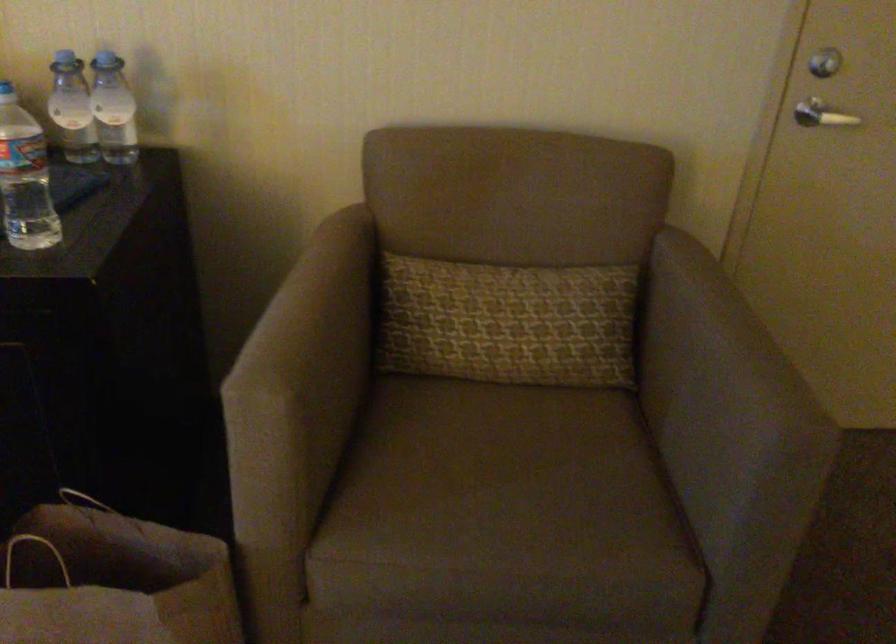
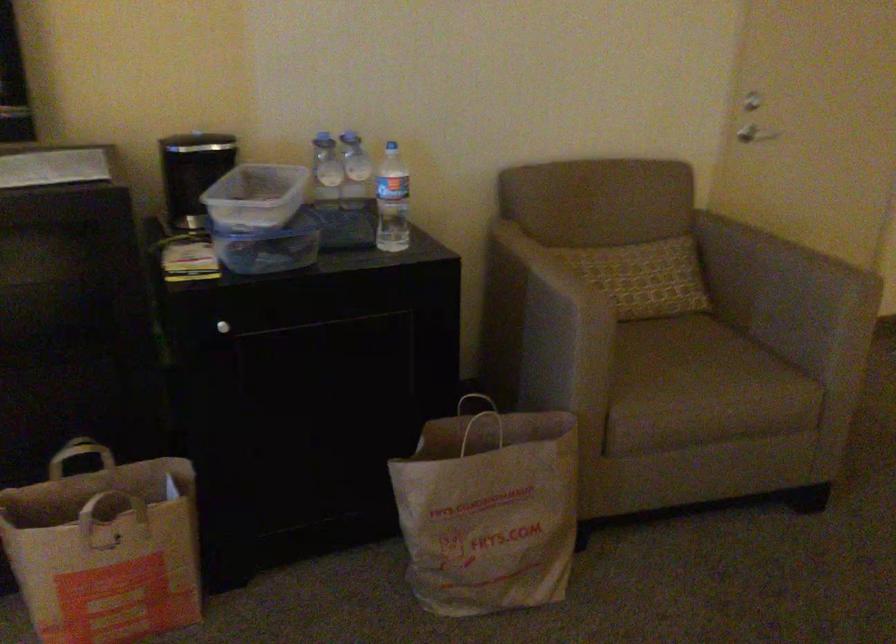
In the second image, find the point that corresponds to (73,102) in the first image.

(325, 169)